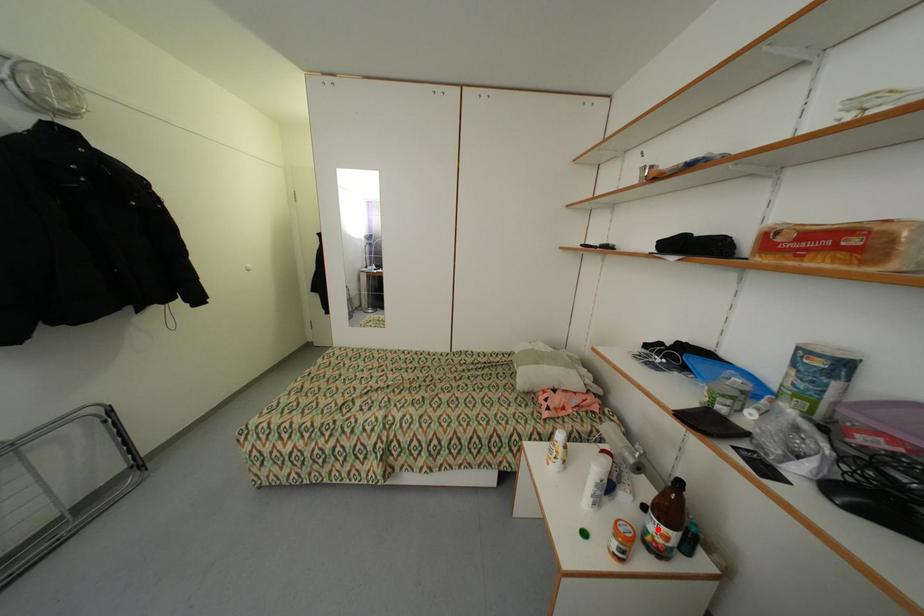
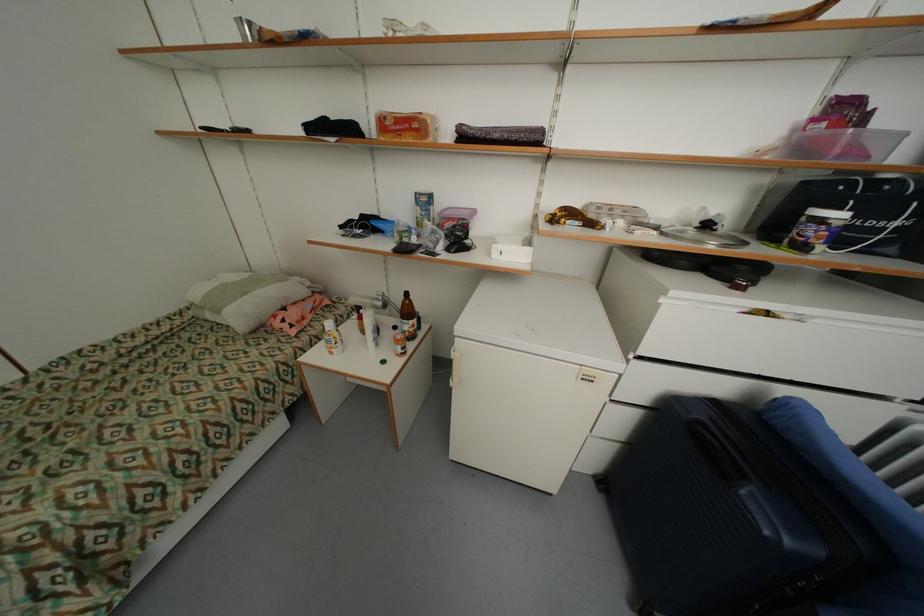
Question: I am providing you with two images of the same scene from different viewpoints. In image1, a red point is highlighted. Considering the same 3D point in image2, which of the following is correct?

Choices:
 (A) It is closer
 (B) It is farther

Answer: (A)